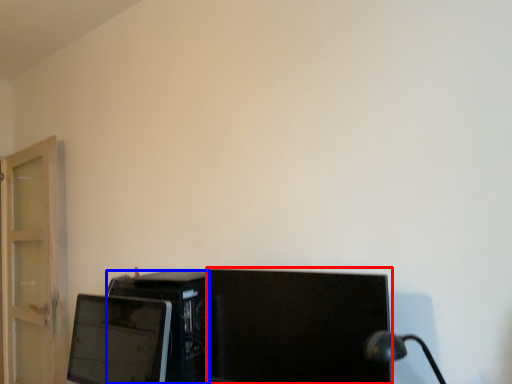
Question: Which of the following is the closest to the observer, computer monitor (highlighted by a red box) or desktop computer (highlighted by a blue box)?

Choices:
 (A) computer monitor
 (B) desktop computer

Answer: (A)